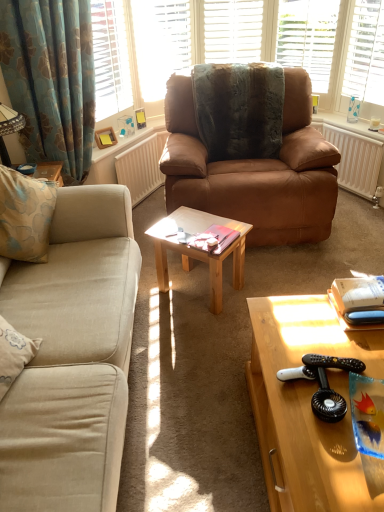
The image size is (384, 512). What do you see at coordinates (142, 167) in the screenshot? I see `white textured radiator at center, which is the second radiator in right-to-left order` at bounding box center [142, 167].

This screenshot has width=384, height=512. Describe the element at coordinates (255, 170) in the screenshot. I see `brown leather armchair at center, the 1th studio couch viewed from the right` at that location.

This screenshot has width=384, height=512. What do you see at coordinates (161, 42) in the screenshot? I see `white wood blinds at upper center, the 1th window viewed from the left` at bounding box center [161, 42].

Find the location of a particular element. The image size is (384, 512). wooden coffee table at lower right, which is counted as the 1th coffee table, starting from the right is located at coordinates (307, 406).

Which object is further away from the camera taking this photo, light brown wooden table at center, which is the 2th coffee table from front to back, or brown leather armchair at center, positioned as the 2th studio couch in front-to-back order?

brown leather armchair at center, positioned as the 2th studio couch in front-to-back order, is further from the camera.

Is light brown wooden table at center, which ranks as the 1th coffee table in left-to-right order, shorter than brown leather armchair at center, positioned as the first studio couch in back-to-front order?

Correct, light brown wooden table at center, which ranks as the 1th coffee table in left-to-right order, is not as tall as brown leather armchair at center, positioned as the first studio couch in back-to-front order.

Is light brown wooden table at center, which is the 1th coffee table from back to front, not close to brown leather armchair at center, which is the second studio couch in left-to-right order?

No.

From the image's perspective, count 1st coffee tables downward from the brown leather armchair at center, positioned as the first studio couch in back-to-front order, and point to it. Please provide its 2D coordinates.

[(199, 251)]

In the image, is white glossy coffee cup at upper right positioned in front of or behind brown leather armchair at center, positioned as the first studio couch in back-to-front order?

white glossy coffee cup at upper right is behind brown leather armchair at center, positioned as the first studio couch in back-to-front order.

Which of these two, white glossy coffee cup at upper right or brown leather armchair at center, positioned as the first studio couch in back-to-front order, is wider?

Wider between the two is brown leather armchair at center, positioned as the first studio couch in back-to-front order.

Can you tell me how much white glossy coffee cup at upper right and brown leather armchair at center, the 1th studio couch viewed from the right, differ in facing direction?

The angular difference between white glossy coffee cup at upper right and brown leather armchair at center, the 1th studio couch viewed from the right, is 60.7 degrees.

Locate an element on the screen. coffee cup that is on the right side of brown leather armchair at center, positioned as the 2th studio couch in front-to-back order is located at coordinates (374, 124).

Image resolution: width=384 pixels, height=512 pixels. What are the coordinates of `the 2nd coffee table below the white wood blinds at upper center, the second window when ordered from left to right (from a real-world perspective)` in the screenshot? It's located at (199, 251).

Considering the relative sizes of light brown wooden table at center, which is the 2th coffee table from front to back, and white wood blinds at upper center, the second window when ordered from left to right, in the image provided, is light brown wooden table at center, which is the 2th coffee table from front to back, shorter than white wood blinds at upper center, the second window when ordered from left to right,?

Indeed, light brown wooden table at center, which is the 2th coffee table from front to back, has a lesser height compared to white wood blinds at upper center, the second window when ordered from left to right.

Do you think light brown wooden table at center, placed as the 2th coffee table when sorted from right to left, is within white wood blinds at upper center, the second window when ordered from left to right, or outside of it?

light brown wooden table at center, placed as the 2th coffee table when sorted from right to left, is not inside white wood blinds at upper center, the second window when ordered from left to right, it's outside.

Is light brown wooden table at center, the second coffee table when ordered from bottom to top, looking in the opposite direction of white wood blinds at upper center, the second window when ordered from left to right?

No, light brown wooden table at center, the second coffee table when ordered from bottom to top, is not facing away from white wood blinds at upper center, the second window when ordered from left to right.

Consider the image. Is white textured radiator at center, which ranks as the 1th radiator in left-to-right order, located within white wood blinds at upper center, the second window when ordered from left to right?

Actually, white textured radiator at center, which ranks as the 1th radiator in left-to-right order, is outside white wood blinds at upper center, the second window when ordered from left to right.

From the image's perspective, which object appears higher, white wood blinds at upper center, the second window when ordered from left to right, or white textured radiator at center, which is the second radiator in right-to-left order?

From the image's view, white wood blinds at upper center, the second window when ordered from left to right, is above.

From a real-world perspective, is white wood blinds at upper center, marked as the second window in a right-to-left arrangement, physically below white textured radiator at center, which is the second radiator in right-to-left order?

No.

Can you confirm if white glossy coffee cup at upper right is wider than blue floral fabric curtain at left?

No.

Which is more to the right, white glossy coffee cup at upper right or blue floral fabric curtain at left?

white glossy coffee cup at upper right.

Between white glossy coffee cup at upper right and blue floral fabric curtain at left, which one is positioned behind?

white glossy coffee cup at upper right is further away from the camera.

Which of these two, matte pink book at center or white matte shutter at upper center, is bigger?

Bigger between the two is white matte shutter at upper center.

Choose the correct answer: Is matte pink book at center inside white matte shutter at upper center or outside it?

matte pink book at center is outside white matte shutter at upper center.

From the image's perspective, is matte pink book at center located beneath white matte shutter at upper center?

Yes, from the image's perspective, matte pink book at center is beneath white matte shutter at upper center.

Could you tell me if wooden coffee table at lower right, which is counted as the 1th coffee table, starting from the right, is facing matte pink book at center?

No, wooden coffee table at lower right, which is counted as the 1th coffee table, starting from the right, is not turned towards matte pink book at center.

Looking at this image, would you consider wooden coffee table at lower right, which is the first coffee table from bottom to top, to be distant from matte pink book at center?

A: No.

Considering the relative sizes of wooden coffee table at lower right, the first coffee table from the front, and matte pink book at center in the image provided, is wooden coffee table at lower right, the first coffee table from the front, smaller than matte pink book at center?

Incorrect, wooden coffee table at lower right, the first coffee table from the front, is not smaller in size than matte pink book at center.

Find the location of `book behind the wooden coffee table at lower right, arranged as the second coffee table when viewed from the back`. book behind the wooden coffee table at lower right, arranged as the second coffee table when viewed from the back is located at coordinates (214, 238).

At what (x,y) coordinates should I click in order to perform the action: click on the 1st coffee table in front when counting from the brown leather armchair at center, which is the second studio couch in left-to-right order. Please return your answer as a coordinate pair (x, y). The height and width of the screenshot is (512, 384). Looking at the image, I should click on (199, 251).

Locate an element on the screen. This screenshot has width=384, height=512. coffee cup on the right of brown leather armchair at center, positioned as the first studio couch in back-to-front order is located at coordinates (374, 124).

Considering their positions, is brown leather armchair at center, positioned as the 2th studio couch in front-to-back order, positioned closer to beige fabric couch at left, which ranks as the first studio couch in front-to-back order, than white wood blinds at upper center, the second window when ordered from left to right?

Among the two, brown leather armchair at center, positioned as the 2th studio couch in front-to-back order, is located nearer to beige fabric couch at left, which ranks as the first studio couch in front-to-back order.

From the image, which object appears to be nearer to white textured radiator at center, which is the second radiator in right-to-left order, white glossy coffee cup at upper right or matte pink book at center?

matte pink book at center lies closer to white textured radiator at center, which is the second radiator in right-to-left order, than the other object.

From the image, which object appears to be nearer to white wood blinds at upper center, the 1th window viewed from the left, matte wooden picture frame at upper left or blue floral fabric curtain at left?

Among the two, matte wooden picture frame at upper left is located nearer to white wood blinds at upper center, the 1th window viewed from the left.

Considering their positions, is white wood blinds at upper center, the second window when ordered from left to right, positioned further to white glossy coffee cup at upper right than clear glass vase at upper right, the 1th window in the right-to-left sequence?

Based on the image, white wood blinds at upper center, the second window when ordered from left to right, appears to be further to white glossy coffee cup at upper right.

Estimate the real-world distances between objects in this image. Which object is closer to beige fabric couch at left, positioned as the second studio couch in right-to-left order, blue floral fabric curtain at left or white wood blinds at upper center, which is the third window from right to left?

The object closer to beige fabric couch at left, positioned as the second studio couch in right-to-left order, is blue floral fabric curtain at left.

Considering their positions, is white textured radiator at right, which appears as the first radiator when viewed from the right, positioned further to light brown wooden table at center, placed as the 2th coffee table when sorted from right to left, than white textured radiator at center, which is the second radiator in right-to-left order?

white textured radiator at right, which appears as the first radiator when viewed from the right, is positioned further to the anchor light brown wooden table at center, placed as the 2th coffee table when sorted from right to left.

Looking at the image, which one is located closer to white textured radiator at right, which appears as the first radiator when viewed from the right, white wood blinds at upper center, the second window when ordered from left to right, or white textured radiator at center, which ranks as the 1th radiator in left-to-right order?

white wood blinds at upper center, the second window when ordered from left to right, is positioned closer to the anchor white textured radiator at right, which appears as the first radiator when viewed from the right.

Based on their spatial positions, is wooden coffee table at lower right, the 2th coffee table viewed from the left, or white matte shutter at upper center closer to beige fabric couch at left, positioned as the second studio couch in right-to-left order?

wooden coffee table at lower right, the 2th coffee table viewed from the left, lies closer to beige fabric couch at left, positioned as the second studio couch in right-to-left order, than the other object.

Identify the location of book positioned between beige fabric couch at left, which ranks as the second studio couch in back-to-front order, and white textured radiator at center, which is the second radiator in right-to-left order, from near to far. (214, 238).

At what (x,y) coordinates should I click in order to perform the action: click on book between blue floral fabric curtain at left and white textured radiator at right, marked as the 2th radiator in a left-to-right arrangement. Please return your answer as a coordinate pair (x, y). The image size is (384, 512). Looking at the image, I should click on (214, 238).

Locate an element on the screen. This screenshot has height=512, width=384. picture frame between white wood blinds at upper center, which is the third window from right to left, and white textured radiator at center, which is the second radiator in right-to-left order, vertically is located at coordinates (105, 137).

This screenshot has width=384, height=512. I want to click on window between brown leather armchair at center, positioned as the first studio couch in back-to-front order, and clear glass vase at upper right, acting as the third window starting from the left, from left to right, so click(x=308, y=37).